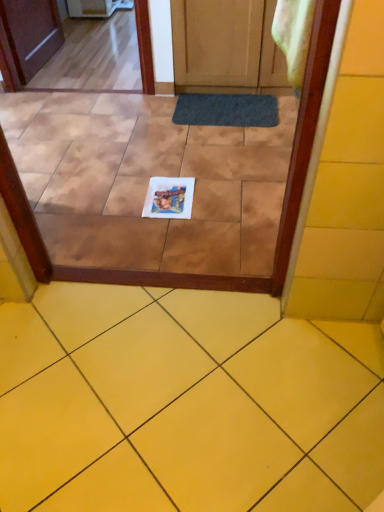
Question: Relative to dark gray rubber doormat at center, is yellow matte tile at lower center in front or behind?

Choices:
 (A) front
 (B) behind

Answer: (A)

Question: From a real-world perspective, is yellow matte tile at lower center physically located above or below dark gray rubber doormat at center?

Choices:
 (A) above
 (B) below

Answer: (A)

Question: Which is farther from the yellow matte tile at lower center?

Choices:
 (A) white paper at center
 (B) dark gray rubber doormat at center
 (C) white glossy coaster at center

Answer: (B)

Question: Considering the real-world distances, which object is closest to the dark gray rubber doormat at center?

Choices:
 (A) white glossy coaster at center
 (B) yellow matte tile at lower center
 (C) white paper at center

Answer: (A)